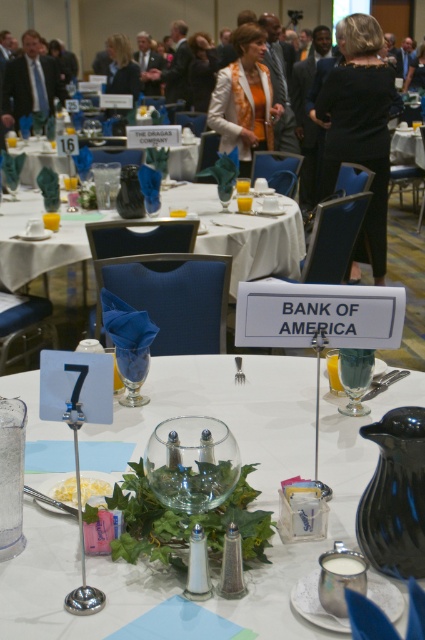
Question: Which object is positioned closest to the white textured blazer at upper center?

Choices:
 (A) white glossy tablecloth at center
 (B) black fabric dress at upper right

Answer: (B)

Question: Based on their relative distances, which object is farther from the blonde hair at upper center?

Choices:
 (A) matte black suit at upper left
 (B) black fabric dress at upper right
 (C) white textured blazer at upper center

Answer: (B)

Question: Can you confirm if white glossy tablecloth at center is positioned to the left of matte black suit at upper left?

Choices:
 (A) no
 (B) yes

Answer: (A)

Question: Does white fabric tablecloth at upper center lie behind blonde hair at upper center?

Choices:
 (A) yes
 (B) no

Answer: (B)

Question: From the image, what is the correct spatial relationship of white glossy tablecloth at center in relation to black fabric dress at upper right?

Choices:
 (A) left
 (B) right

Answer: (A)

Question: Which of these objects is positioned farthest from the white textured blazer at upper center?

Choices:
 (A) matte black suit at upper left
 (B) black fabric dress at upper right
 (C) white glossy tablecloth at center
 (D) blonde hair at upper center

Answer: (C)